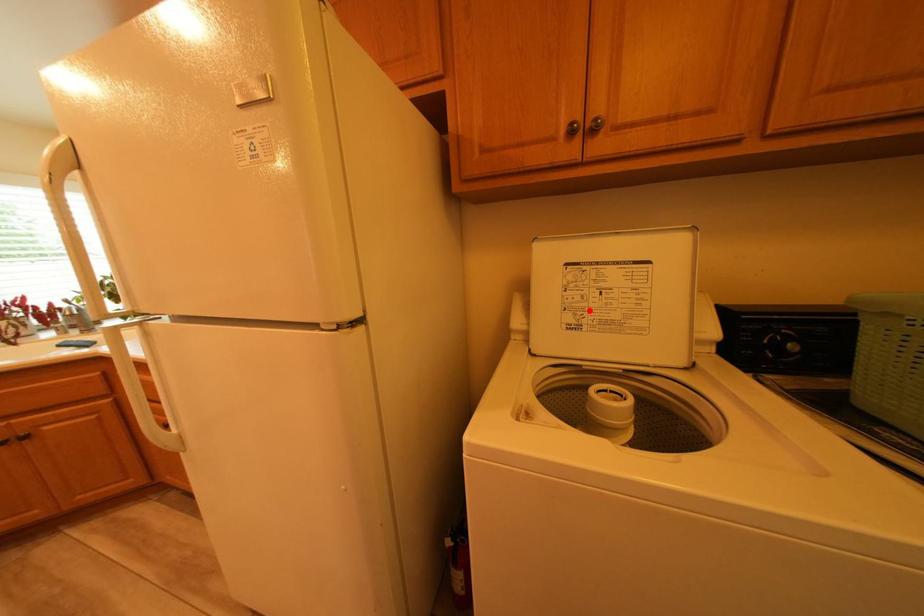
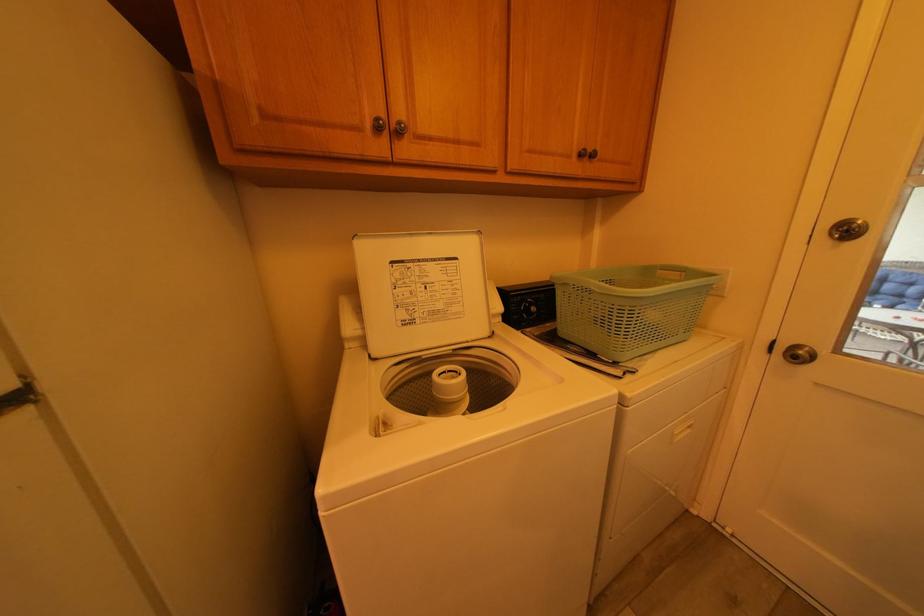
Locate, in the second image, the point that corresponds to the highlighted location in the first image.

(420, 306)